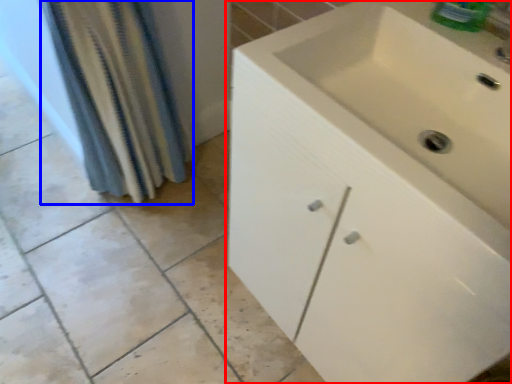
Question: Among these objects, which one is farthest to the camera, bathroom cabinet (highlighted by a red box) or shower curtain (highlighted by a blue box)?

Choices:
 (A) bathroom cabinet
 (B) shower curtain

Answer: (B)